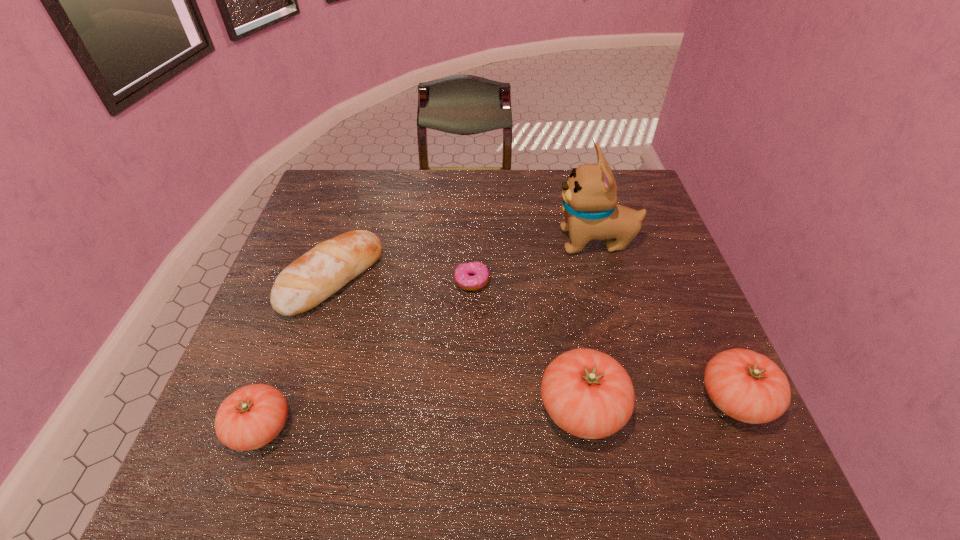
The height and width of the screenshot is (540, 960). Identify the location of object present at the near left corner. (252, 416).

This screenshot has width=960, height=540. What are the coordinates of `object positioned at the near right corner` in the screenshot? It's located at (747, 386).

Where is `vacant position at the far edge of the desktop`? vacant position at the far edge of the desktop is located at coordinates (477, 173).

Find the location of `free space at the near edge of the desktop`. free space at the near edge of the desktop is located at coordinates (655, 428).

You are a GUI agent. You are given a task and a screenshot of the screen. Output one action in this format:
    pyautogui.click(x=<x>, y=<y>)
    Task: Click on the vacant space at the left edge of the desktop
    This screenshot has height=540, width=960.
    Given the screenshot: What is the action you would take?
    pyautogui.click(x=350, y=221)

The width and height of the screenshot is (960, 540). I want to click on vacant space at the right edge of the desktop, so click(670, 314).

The width and height of the screenshot is (960, 540). What are the coordinates of `vacant area at the far right corner of the desktop` in the screenshot? It's located at (655, 209).

The height and width of the screenshot is (540, 960). I want to click on empty location between the bread and the tallest object, so click(464, 260).

Where is `free area in between the leftmost tomato and the bread`? free area in between the leftmost tomato and the bread is located at coordinates (297, 353).

You are a GUI agent. You are given a task and a screenshot of the screen. Output one action in this format:
    pyautogui.click(x=<x>, y=<y>)
    Task: Click on the free space that is in between the rightmost object and the puppy
    The image size is (960, 540).
    Given the screenshot: What is the action you would take?
    pyautogui.click(x=665, y=320)